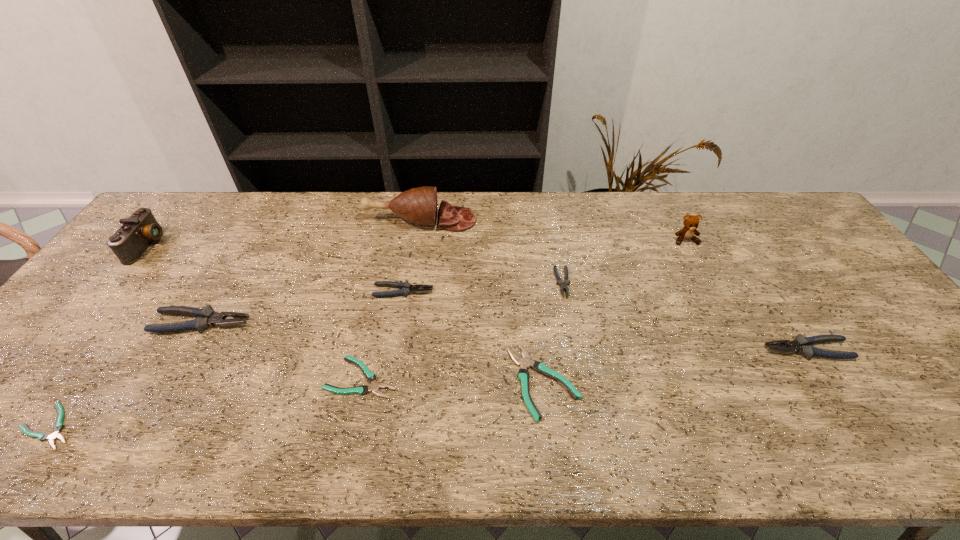
Where is `the smallest gray pliers`? This screenshot has height=540, width=960. the smallest gray pliers is located at coordinates (559, 281).

At what (x,y) coordinates should I click in order to perform the action: click on the eighth tallest object. Please return your answer as a coordinate pair (x, y). This screenshot has width=960, height=540. Looking at the image, I should click on (523, 375).

The width and height of the screenshot is (960, 540). I want to click on the third shortest pliers, so click(x=523, y=375).

The height and width of the screenshot is (540, 960). What are the coordinates of `the second teal pliers from left to right` in the screenshot? It's located at (370, 376).

At what (x,y) coordinates should I click in order to perform the action: click on the second biggest teal pliers. Please return your answer as a coordinate pair (x, y). The width and height of the screenshot is (960, 540). Looking at the image, I should click on (370, 376).

Where is `the leftmost teal pliers`? Image resolution: width=960 pixels, height=540 pixels. the leftmost teal pliers is located at coordinates (58, 426).

Locate an element on the screen. This screenshot has height=540, width=960. the smallest teal pliers is located at coordinates (58, 426).

Locate an element on the screen. This screenshot has height=540, width=960. free location located 0.090m at the sliced end of the tallest object is located at coordinates (503, 220).

Locate an element on the screen. Image resolution: width=960 pixels, height=540 pixels. free space located 0.090m on the front-facing side of the teddy bear is located at coordinates (699, 266).

This screenshot has width=960, height=540. What are the coordinates of `vacant space located 0.210m on the lens of the leftmost object` in the screenshot? It's located at (228, 245).